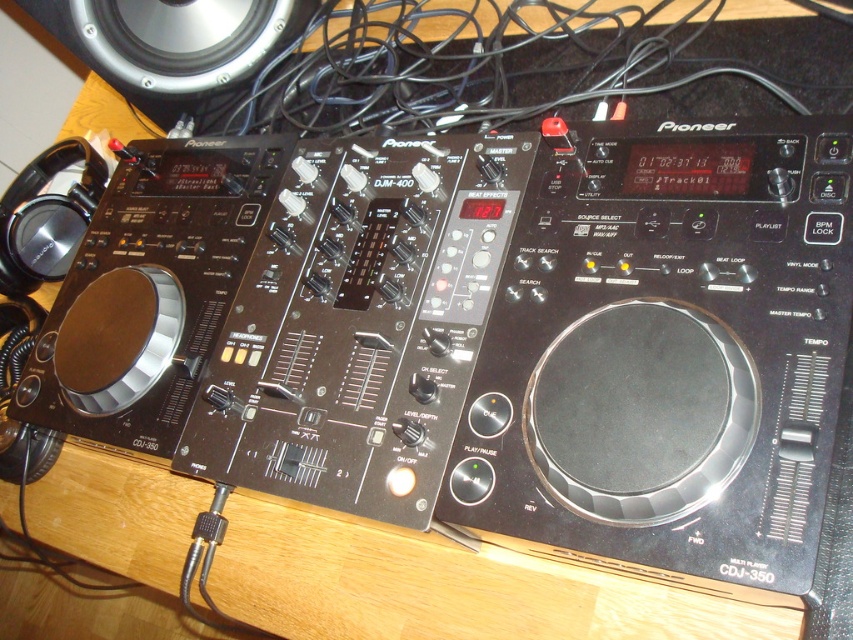
You are setting up a DJ booth and need to connect the Pioneer CDJ equipment. Where is the black plastic wire at upper center in relation to the CDJ equipment?

The black plastic wire at upper center is located at point (x=535, y=64), which is to the left of the CDJ equipment.

You are a DJ technician who needs to reach the black plastic wire at upper center while standing at your current position. Can you comfortably reach it without moving your feet?

The black plastic wire at upper center is 30.16 inches away from the viewer, so yes, you can comfortably reach it without moving your feet since the distance is within a typical arm reach.

You are setting up a DJ booth and need to connect the black plastic wire at upper center to the silver metallic speaker at upper left. Based on their positions, will the wire reach the speaker without needing to move either device?

The black plastic wire at upper center is in front of the silver metallic speaker at upper left, so the wire can easily reach the speaker without needing to move either device.